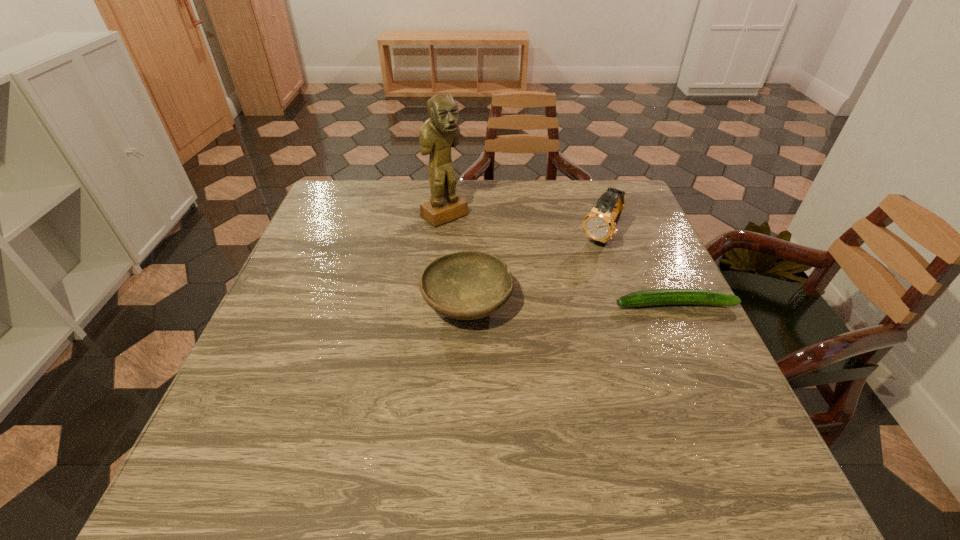
Identify the location of bowl. The image size is (960, 540). (467, 285).

Where is `the shortest object`? the shortest object is located at coordinates (655, 297).

Locate an element on the screen. This screenshot has width=960, height=540. figurine is located at coordinates (441, 131).

Where is `the second tallest object`? This screenshot has width=960, height=540. the second tallest object is located at coordinates pyautogui.click(x=599, y=224).

Locate an element on the screen. free space located 0.120m on the back of the second shortest object is located at coordinates (468, 244).

Find the location of a particular element. Image resolution: width=960 pixels, height=540 pixels. vacant space located 0.050m on the front-facing side of the tallest object is located at coordinates (469, 234).

At what (x,y) coordinates should I click in order to perform the action: click on free space located 0.270m on the front-facing side of the tallest object. Please return your answer as a coordinate pair (x, y). The width and height of the screenshot is (960, 540). Looking at the image, I should click on (524, 276).

Find the location of a particular element. free location located on the front-facing side of the tallest object is located at coordinates (529, 281).

Where is `free space located on the face of the watch`? free space located on the face of the watch is located at coordinates (577, 270).

The width and height of the screenshot is (960, 540). Find the location of `free space located on the face of the watch`. free space located on the face of the watch is located at coordinates (583, 264).